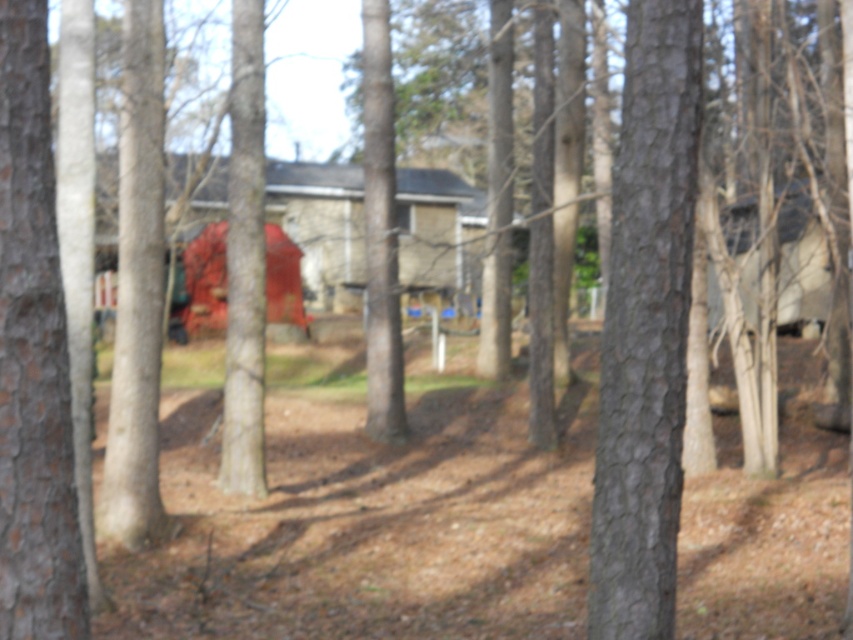
Question: Does smooth bark tree at center have a larger size compared to smooth bark tree at left?

Choices:
 (A) yes
 (B) no

Answer: (A)

Question: Which point is closer to the camera?

Choices:
 (A) (614, 637)
 (B) (22, 417)

Answer: (B)

Question: Among these objects, which one is farthest from the camera?

Choices:
 (A) smooth bark tree at left
 (B) smooth bark tree at center

Answer: (B)

Question: Among these objects, which one is farthest from the camera?

Choices:
 (A) smooth bark tree at center
 (B) smooth bark tree at left

Answer: (A)

Question: Where is smooth bark tree at center located in relation to smooth bark tree at left in the image?

Choices:
 (A) left
 (B) right

Answer: (B)

Question: Does smooth bark tree at center appear under smooth bark tree at left?

Choices:
 (A) no
 (B) yes

Answer: (A)